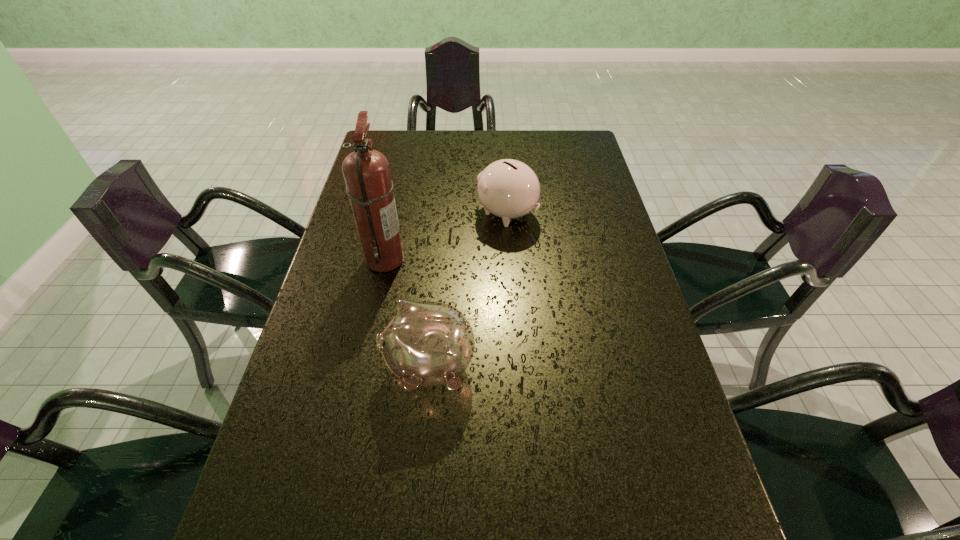
You are a GUI agent. You are given a task and a screenshot of the screen. Output one action in this format:
    pyautogui.click(x=<x>, y=<y>)
    Task: Click on the vacant space positioned on the back of the farthest object
    
    Given the screenshot: What is the action you would take?
    pyautogui.click(x=505, y=183)

At what (x,y) coordinates should I click in order to perform the action: click on object situated at the left edge. Please return your answer as a coordinate pair (x, y). Looking at the image, I should click on (369, 186).

This screenshot has height=540, width=960. In order to click on vacant space at the far edge of the desktop in this screenshot , I will do `click(537, 158)`.

Image resolution: width=960 pixels, height=540 pixels. In the image, there is a desktop. What are the coordinates of `vacant region at the left edge` in the screenshot? It's located at (338, 400).

This screenshot has height=540, width=960. I want to click on free region at the right edge, so click(597, 212).

You are a GUI agent. You are given a task and a screenshot of the screen. Output one action in this format:
    pyautogui.click(x=<x>, y=<y>)
    Task: Click on the free space at the far right corner
    The height and width of the screenshot is (540, 960).
    Given the screenshot: What is the action you would take?
    pyautogui.click(x=588, y=145)

Identify the location of free space between the second nearest object and the farther piggy bank. (446, 236).

Where is `empty space that is in between the second farthest object and the farthest object`? This screenshot has height=540, width=960. empty space that is in between the second farthest object and the farthest object is located at coordinates (446, 236).

Locate an element on the screen. This screenshot has width=960, height=540. free space between the second farthest object and the right piggy bank is located at coordinates (446, 236).

Locate an element on the screen. free point between the rightmost object and the tallest object is located at coordinates (446, 236).